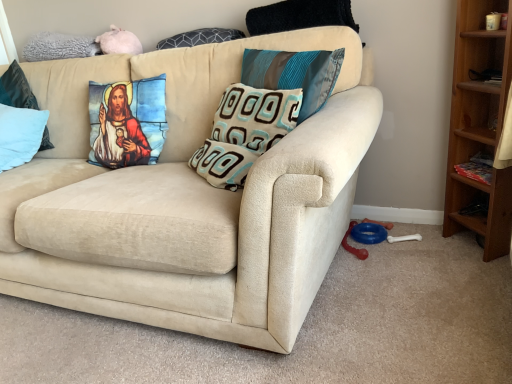
Question: Is dark gray textured pillow at upper center, arranged as the third pillow when viewed from the right, wider than light blue fabric pillow at left, the first pillow in the left-to-right sequence?

Choices:
 (A) yes
 (B) no

Answer: (B)

Question: From the image's perspective, would you say dark gray textured pillow at upper center, arranged as the third pillow when viewed from the right, is positioned over light blue fabric pillow at left, the 5th pillow viewed from the right?

Choices:
 (A) no
 (B) yes

Answer: (B)

Question: Is dark gray textured pillow at upper center, arranged as the third pillow when viewed from the right, thinner than light blue fabric pillow at left, the first pillow in the left-to-right sequence?

Choices:
 (A) yes
 (B) no

Answer: (A)

Question: From a real-world perspective, is dark gray textured pillow at upper center, the 3th pillow in the left-to-right sequence, over light blue fabric pillow at left, the first pillow in the left-to-right sequence?

Choices:
 (A) yes
 (B) no

Answer: (A)

Question: Are dark gray textured pillow at upper center, arranged as the third pillow when viewed from the right, and light blue fabric pillow at left, the 5th pillow viewed from the right, beside each other?

Choices:
 (A) no
 (B) yes

Answer: (A)

Question: Is dark gray textured pillow at upper center, the 3th pillow in the left-to-right sequence, located outside light blue fabric pillow at left, the first pillow in the left-to-right sequence?

Choices:
 (A) yes
 (B) no

Answer: (A)

Question: Can you confirm if light blue fabric pillow at left, which appears as the 2th pillow when viewed from the left, is smaller than light blue fabric pillow at left, the first pillow in the left-to-right sequence?

Choices:
 (A) yes
 (B) no

Answer: (A)

Question: Is light blue fabric pillow at left, which appears as the 2th pillow when viewed from the left, to the left of light blue fabric pillow at left, the first pillow in the left-to-right sequence, from the viewer's perspective?

Choices:
 (A) no
 (B) yes

Answer: (A)

Question: Does light blue fabric pillow at left, which appears as the 4th pillow when viewed from the right, have a larger size compared to light blue fabric pillow at left, the 5th pillow viewed from the right?

Choices:
 (A) no
 (B) yes

Answer: (A)

Question: Is light blue fabric pillow at left, which appears as the 4th pillow when viewed from the right, next to light blue fabric pillow at left, the 5th pillow viewed from the right?

Choices:
 (A) no
 (B) yes

Answer: (A)

Question: From a real-world perspective, is light blue fabric pillow at left, which appears as the 4th pillow when viewed from the right, on light blue fabric pillow at left, the 5th pillow viewed from the right?

Choices:
 (A) no
 (B) yes

Answer: (B)

Question: Considering the relative sizes of light blue fabric pillow at left, which appears as the 2th pillow when viewed from the left, and light blue fabric pillow at left, the first pillow in the left-to-right sequence, in the image provided, is light blue fabric pillow at left, which appears as the 2th pillow when viewed from the left, wider than light blue fabric pillow at left, the first pillow in the left-to-right sequence,?

Choices:
 (A) yes
 (B) no

Answer: (B)

Question: Does beige textured pillow at center, which is the fourth pillow from left to right, appear on the left side of teal silk pillow at upper center, the fifth pillow in the left-to-right sequence?

Choices:
 (A) no
 (B) yes

Answer: (B)